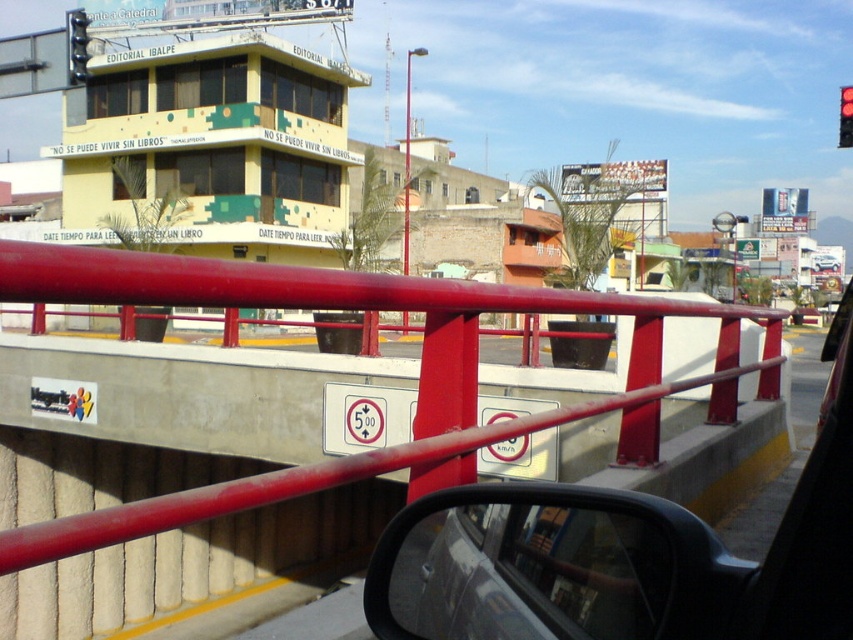
Is red metal/rail at center taller than metallic pole at center?

No, red metal/rail at center is not taller than metallic pole at center.

Who is more forward, (263,458) or (405,100)?

Positioned in front is point (263,458).

You are a GUI agent. You are given a task and a screenshot of the screen. Output one action in this format:
    pyautogui.click(x=<x>, y=<y>)
    Task: Click on the red metal/rail at center
    This screenshot has width=853, height=640.
    Given the screenshot: What is the action you would take?
    pyautogui.click(x=373, y=378)

Can you confirm if black glossy car at center is positioned to the right of metallic pole at center?

Correct, you'll find black glossy car at center to the right of metallic pole at center.

Is point (486, 600) closer to camera compared to point (407, 77)?

Yes, point (486, 600) is in front of point (407, 77).

This screenshot has width=853, height=640. I want to click on black glossy car at center, so tap(624, 556).

Can you confirm if black glossy car at center is positioned below metallic traffic light at upper left?

Yes.

Which is more to the left, black glossy car at center or metallic traffic light at upper left?

Positioned to the left is metallic traffic light at upper left.

Where is `black glossy car at center`? The width and height of the screenshot is (853, 640). black glossy car at center is located at coordinates (624, 556).